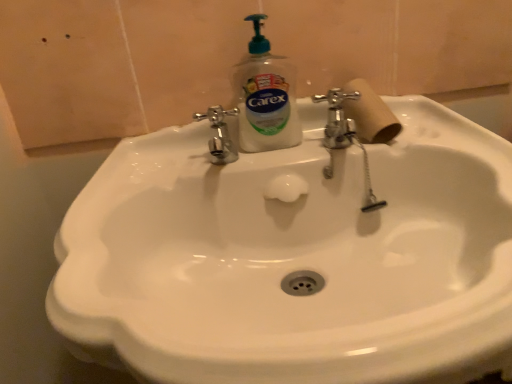
Question: Does wooden at right have a greater width compared to white glossy sink at center?

Choices:
 (A) yes
 (B) no

Answer: (B)

Question: From the image's perspective, does wooden at right appear higher than white glossy sink at center?

Choices:
 (A) yes
 (B) no

Answer: (A)

Question: Can you confirm if wooden at right is positioned to the right of white glossy sink at center?

Choices:
 (A) yes
 (B) no

Answer: (A)

Question: Is wooden at right far from white glossy sink at center?

Choices:
 (A) yes
 (B) no

Answer: (B)

Question: Is wooden at right oriented towards white glossy sink at center?

Choices:
 (A) no
 (B) yes

Answer: (A)

Question: Relative to clear plastic soap dispenser at center, is white glossy sink at center in front or behind?

Choices:
 (A) front
 (B) behind

Answer: (A)

Question: Would you say white glossy sink at center is inside or outside clear plastic soap dispenser at center?

Choices:
 (A) inside
 (B) outside

Answer: (B)

Question: Is white glossy sink at center wider or thinner than clear plastic soap dispenser at center?

Choices:
 (A) thin
 (B) wide

Answer: (B)

Question: Is white glossy sink at center to the left or to the right of clear plastic soap dispenser at center in the image?

Choices:
 (A) left
 (B) right

Answer: (B)

Question: From the image's perspective, relative to clear plastic soap dispenser at center, is wooden at right above or below?

Choices:
 (A) above
 (B) below

Answer: (B)

Question: Which is correct: wooden at right is inside clear plastic soap dispenser at center, or outside of it?

Choices:
 (A) inside
 (B) outside

Answer: (B)

Question: Is point (379, 110) closer or farther from the camera than point (250, 97)?

Choices:
 (A) farther
 (B) closer

Answer: (B)

Question: Is wooden at right to the left or to the right of clear plastic soap dispenser at center in the image?

Choices:
 (A) left
 (B) right

Answer: (B)

Question: In terms of width, does clear plastic soap dispenser at center look wider or thinner when compared to wooden at right?

Choices:
 (A) thin
 (B) wide

Answer: (A)

Question: Is clear plastic soap dispenser at center inside or outside of wooden at right?

Choices:
 (A) inside
 (B) outside

Answer: (B)